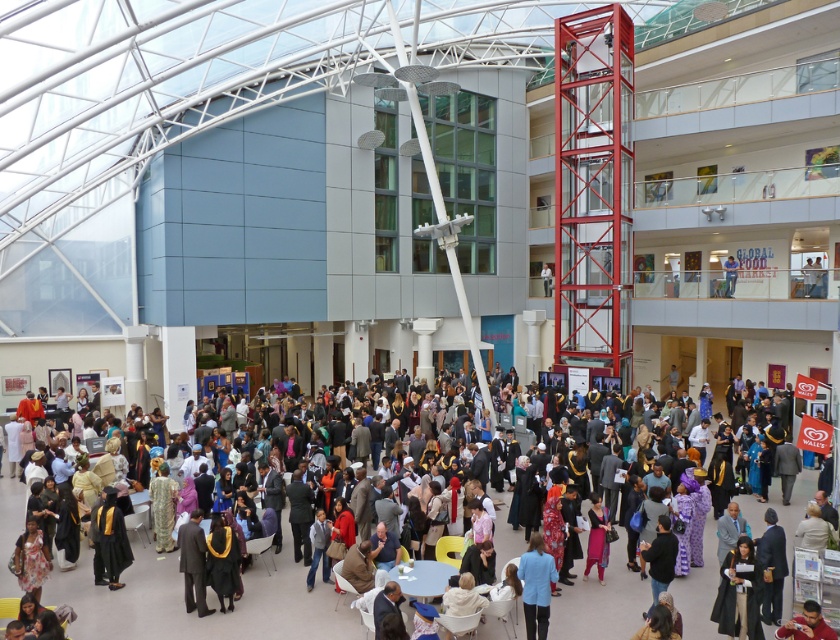
This screenshot has height=640, width=840. What are the coordinates of `blue fabric jacket at lower center` in the screenshot? It's located at [x=536, y=586].

Between blue fabric jacket at lower center and matte black suit at center, which one appears on the right side from the viewer's perspective?

matte black suit at center

Between point (525, 600) and point (727, 260), which one is positioned behind?

Point (727, 260)

Where is `blue fabric jacket at lower center`? The width and height of the screenshot is (840, 640). blue fabric jacket at lower center is located at coordinates (536, 586).

Which of these two, matte black graduation gown at center or blue fabric jacket at lower center, stands taller?

blue fabric jacket at lower center

Can you confirm if matte black graduation gown at center is positioned to the left of blue fabric jacket at lower center?

Correct, you'll find matte black graduation gown at center to the left of blue fabric jacket at lower center.

Image resolution: width=840 pixels, height=640 pixels. I want to click on matte black graduation gown at center, so click(193, 612).

This screenshot has height=640, width=840. Identify the location of matte black graduation gown at center. (193, 612).

Is matte black graduation gown at center closer to camera compared to matte black suit at center?

Yes.

Who is more distant from viewer, (285, 545) or (728, 262)?

Positioned behind is point (728, 262).

In order to click on matte black graduation gown at center in this screenshot , I will do `click(193, 612)`.